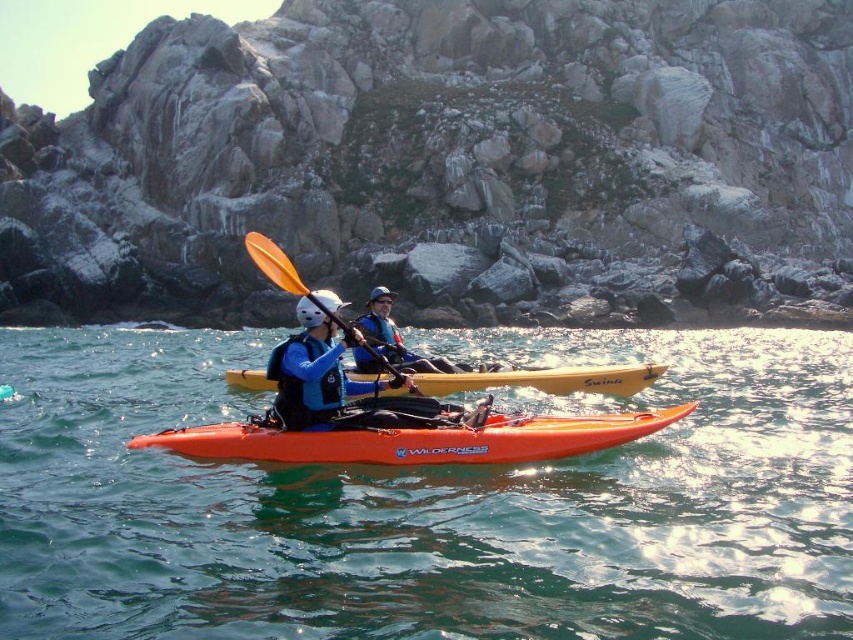
Looking at this image, you are a safety inspector checking the kayakers. According to the image, which item is positioned closer to the front of the kayak between the matte blue life vest at center and the matte blue jacket at center?

The matte blue life vest at center is positioned in front of the matte blue jacket at center, so it is closer to the front of the kayak.

You are navigating a kayak and need to determine the position of two points on your GPS. The first point is labeled as point [335,381] and the second is point [378,308]. Based on the scene, which point is closer to your current location if you are positioned behind the yellow kayak?

Point [335,381] is in front of point [378,308], so if you are positioned behind the yellow kayak, the closer point would be point [335,381].

You are a safety inspector checking the kayakers. According to the image, is the matte blue life vest at center properly positioned on the orange matte kayak at center?

The orange matte kayak at center is below the matte blue life vest at center, which means the life vest is not correctly positioned on the kayak. The life vest should be placed on the kayak, not above it.